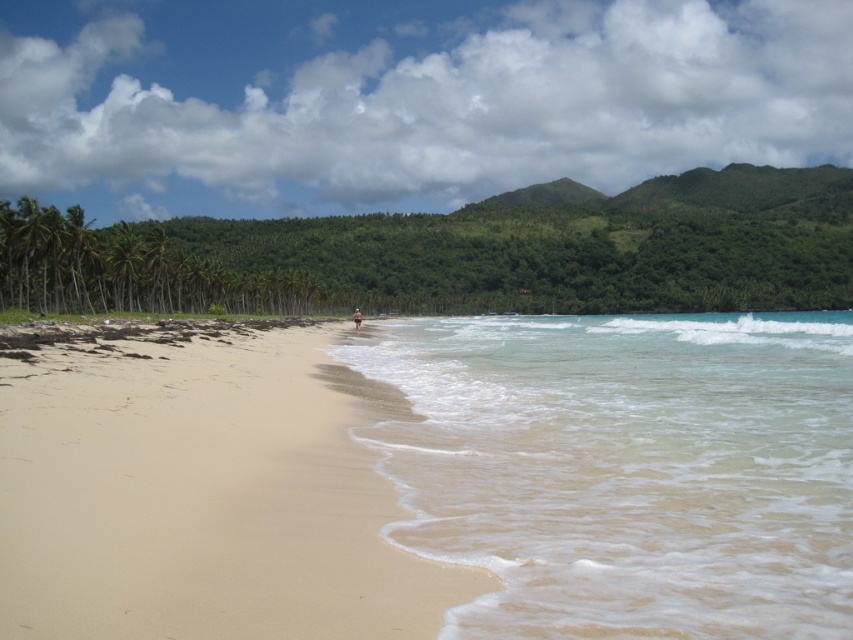
Question: Which point is farther to the camera?

Choices:
 (A) sandy beach at lower left
 (B) clear water at lower right

Answer: (B)

Question: Which point is closer to the camera taking this photo?

Choices:
 (A) (387, 372)
 (B) (190, 586)

Answer: (B)

Question: Which object is positioned farthest from the clear water at lower right?

Choices:
 (A) green leafy palm tree at left
 (B) sandy beach at lower left

Answer: (A)

Question: Can you confirm if sandy beach at lower left is thinner than green leafy palm tree at left?

Choices:
 (A) yes
 (B) no

Answer: (B)

Question: Can you confirm if sandy beach at lower left is wider than green leafy palm tree at left?

Choices:
 (A) yes
 (B) no

Answer: (A)

Question: Can you confirm if clear water at lower right is positioned above green leafy palm tree at left?

Choices:
 (A) no
 (B) yes

Answer: (A)